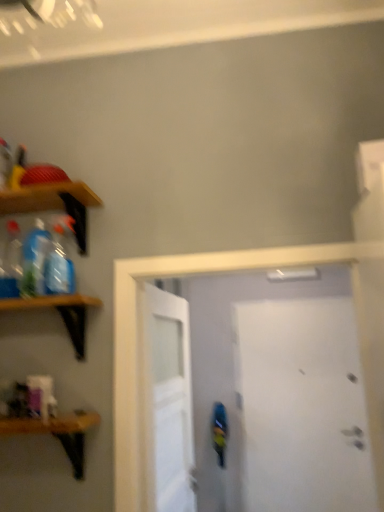
Question: Can you confirm if white matte door at right, which is the third door in front-to-back order, is positioned to the left of translucent plastic bottle at left, which is the 2th bottle in left-to-right order?

Choices:
 (A) yes
 (B) no

Answer: (B)

Question: Does white matte door at right, which is the third door in front-to-back order, have a lesser width compared to translucent plastic bottle at left, the 2th bottle when ordered from right to left?

Choices:
 (A) no
 (B) yes

Answer: (B)

Question: Is white matte door at right, which is the third door in front-to-back order, facing towards translucent plastic bottle at left, the 2th bottle when ordered from right to left?

Choices:
 (A) no
 (B) yes

Answer: (A)

Question: Is white matte door at right, which is the 1th door in back-to-front order, smaller than translucent plastic bottle at left, the 2th bottle when ordered from right to left?

Choices:
 (A) no
 (B) yes

Answer: (A)

Question: Can translucent plastic bottle at left, the 2th bottle when ordered from right to left, be found inside white matte door at right, which is the third door in front-to-back order?

Choices:
 (A) no
 (B) yes

Answer: (A)

Question: Is white matte door at right, which is the third door in front-to-back order, positioned behind translucent plastic bottle at left, which is the 2th bottle in left-to-right order?

Choices:
 (A) yes
 (B) no

Answer: (A)

Question: From a real-world perspective, does translucent plastic bottle at left, which is the 2th bottle in left-to-right order, stand above white matte door at center, marked as the 2th door in a back-to-front arrangement?

Choices:
 (A) yes
 (B) no

Answer: (A)

Question: From the image's perspective, is translucent plastic bottle at left, the 2th bottle when ordered from right to left, under white matte door at center, marked as the 2th door in a back-to-front arrangement?

Choices:
 (A) no
 (B) yes

Answer: (A)

Question: From the image's perspective, is translucent plastic bottle at left, the 2th bottle when ordered from right to left, above white matte door at center, marked as the 2th door in a back-to-front arrangement?

Choices:
 (A) no
 (B) yes

Answer: (B)

Question: Considering the relative sizes of translucent plastic bottle at left, the 2th bottle when ordered from right to left, and white matte door at center, marked as the 2th door in a back-to-front arrangement, in the image provided, is translucent plastic bottle at left, the 2th bottle when ordered from right to left, wider than white matte door at center, marked as the 2th door in a back-to-front arrangement,?

Choices:
 (A) no
 (B) yes

Answer: (B)

Question: Is translucent plastic bottle at left, which is the 2th bottle in left-to-right order, shorter than white matte door at center, which is the second door in front-to-back order?

Choices:
 (A) no
 (B) yes

Answer: (B)

Question: Could you tell me if translucent plastic bottle at left, the 2th bottle when ordered from right to left, is facing white matte door at center, marked as the 2th door in a back-to-front arrangement?

Choices:
 (A) no
 (B) yes

Answer: (A)

Question: Is wooden shelf at left, the third shelf positioned from the bottom, outside of translucent plastic bottle at left, which is the 3th bottle from right to left?

Choices:
 (A) no
 (B) yes

Answer: (B)